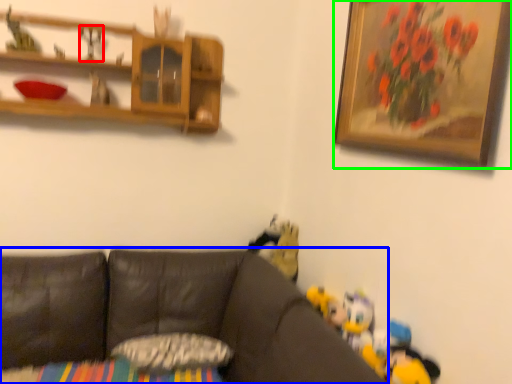
Question: Based on their relative distances, which object is nearer to toy (highlighted by a red box)? Choose from studio couch (highlighted by a blue box) and picture frame (highlighted by a green box).

Choices:
 (A) studio couch
 (B) picture frame

Answer: (A)